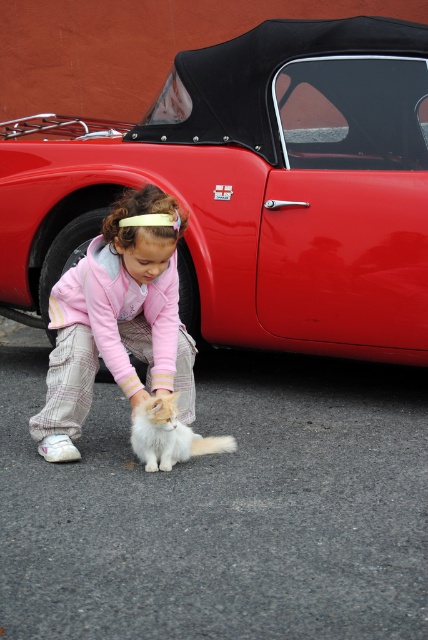
Question: Which object appears closest to the camera in this image?

Choices:
 (A) shiny red car at center
 (B) pink fleece jacket at center
 (C) white fluffy cat at lower center

Answer: (B)

Question: Which of the following is the farthest from the observer?

Choices:
 (A) white fluffy cat at lower center
 (B) shiny red car at center

Answer: (B)

Question: In this image, where is shiny red car at center located relative to white fluffy cat at lower center?

Choices:
 (A) left
 (B) right

Answer: (A)

Question: Observing the image, what is the correct spatial positioning of shiny red car at center in reference to white fluffy cat at lower center?

Choices:
 (A) left
 (B) right

Answer: (A)

Question: Is shiny red car at center bigger than white fluffy cat at lower center?

Choices:
 (A) no
 (B) yes

Answer: (B)

Question: Which object is positioned closest to the white fluffy cat at lower center?

Choices:
 (A) pink fleece jacket at center
 (B) shiny red car at center

Answer: (A)